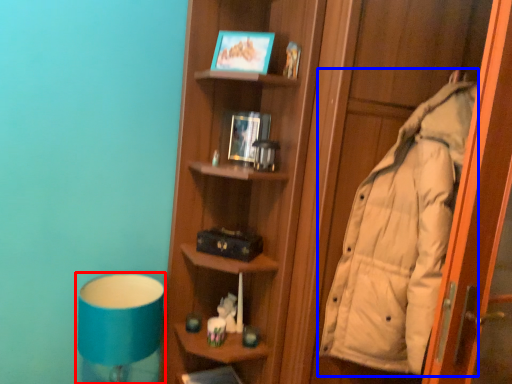
Question: Which object appears farthest to the camera in this image, bedside lamp (highlighted by a red box) or coat (highlighted by a blue box)?

Choices:
 (A) bedside lamp
 (B) coat

Answer: (A)